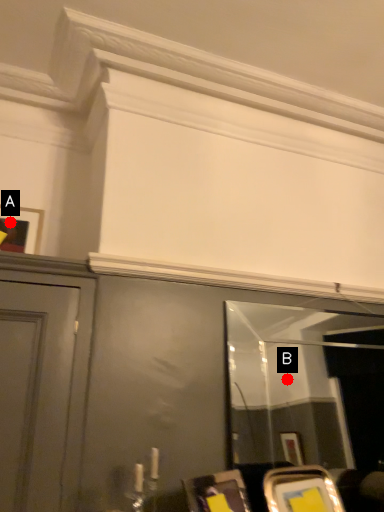
Question: Two points are circled on the image, labeled by A and B beside each circle. Which point is further to the camera?

Choices:
 (A) A is further
 (B) B is further

Answer: (B)